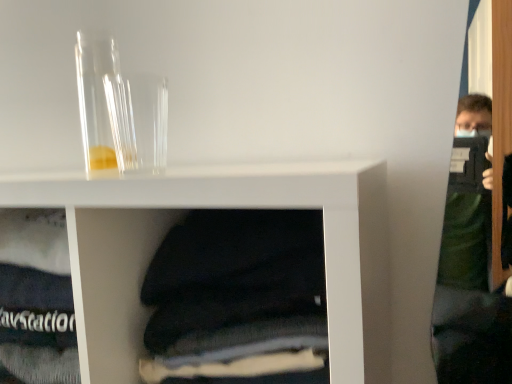
Image resolution: width=512 pixels, height=384 pixels. What are the coordinates of `transparent glass tube at upper left, positioned as the 2th glass vase in right-to-left order` in the screenshot? It's located at (102, 104).

This screenshot has width=512, height=384. Describe the element at coordinates (102, 104) in the screenshot. I see `transparent glass tube at upper left, which is counted as the first glass vase, starting from the left` at that location.

I want to click on transparent glass vase at upper left, positioned as the second glass vase in left-to-right order, so click(x=138, y=121).

What do you see at coordinates (138, 121) in the screenshot? This screenshot has height=384, width=512. I see `transparent glass vase at upper left, which is the 1th glass vase from right to left` at bounding box center [138, 121].

Find the location of `transparent glass tube at upper left, positioned as the 2th glass vase in right-to-left order`. transparent glass tube at upper left, positioned as the 2th glass vase in right-to-left order is located at coordinates (102, 104).

Which object is positioned more to the left, transparent glass vase at upper left, which is the 1th glass vase from right to left, or transparent glass tube at upper left, which is counted as the first glass vase, starting from the left?

transparent glass tube at upper left, which is counted as the first glass vase, starting from the left, is more to the left.

In the image, is transparent glass vase at upper left, positioned as the second glass vase in left-to-right order, positioned in front of or behind transparent glass tube at upper left, which is counted as the first glass vase, starting from the left?

Clearly, transparent glass vase at upper left, positioned as the second glass vase in left-to-right order, is in front of transparent glass tube at upper left, which is counted as the first glass vase, starting from the left.

Is point (110, 94) more distant than point (108, 44)?

No, it is in front of (108, 44).

From the image's perspective, is transparent glass vase at upper left, which is the 1th glass vase from right to left, positioned above or below transparent glass tube at upper left, which is counted as the first glass vase, starting from the left?

Based on their image positions, transparent glass vase at upper left, which is the 1th glass vase from right to left, is located beneath transparent glass tube at upper left, which is counted as the first glass vase, starting from the left.

From a real-world perspective, is transparent glass vase at upper left, positioned as the second glass vase in left-to-right order, positioned under transparent glass tube at upper left, which is counted as the first glass vase, starting from the left, based on gravity?

Indeed, from a real-world perspective, transparent glass vase at upper left, positioned as the second glass vase in left-to-right order, is positioned beneath transparent glass tube at upper left, which is counted as the first glass vase, starting from the left.

Does transparent glass vase at upper left, which is the 1th glass vase from right to left, have a greater width compared to transparent glass tube at upper left, which is counted as the first glass vase, starting from the left?

Yes.

Considering the relative sizes of transparent glass vase at upper left, which is the 1th glass vase from right to left, and transparent glass tube at upper left, which is counted as the first glass vase, starting from the left, in the image provided, is transparent glass vase at upper left, which is the 1th glass vase from right to left, taller than transparent glass tube at upper left, which is counted as the first glass vase, starting from the left,?

Incorrect, the height of transparent glass vase at upper left, which is the 1th glass vase from right to left, is not larger of that of transparent glass tube at upper left, which is counted as the first glass vase, starting from the left.

Considering the sizes of objects transparent glass vase at upper left, positioned as the second glass vase in left-to-right order, and transparent glass tube at upper left, positioned as the 2th glass vase in right-to-left order, in the image provided, who is bigger, transparent glass vase at upper left, positioned as the second glass vase in left-to-right order, or transparent glass tube at upper left, positioned as the 2th glass vase in right-to-left order,?

transparent glass tube at upper left, positioned as the 2th glass vase in right-to-left order, is bigger.

Is transparent glass vase at upper left, positioned as the second glass vase in left-to-right order, located outside transparent glass tube at upper left, positioned as the 2th glass vase in right-to-left order?

transparent glass vase at upper left, positioned as the second glass vase in left-to-right order, is positioned outside transparent glass tube at upper left, positioned as the 2th glass vase in right-to-left order.

Is transparent glass vase at upper left, positioned as the second glass vase in left-to-right order, directly adjacent to transparent glass tube at upper left, positioned as the 2th glass vase in right-to-left order?

Yes, the surface of transparent glass vase at upper left, positioned as the second glass vase in left-to-right order, is in contact with transparent glass tube at upper left, positioned as the 2th glass vase in right-to-left order.

Is transparent glass vase at upper left, positioned as the second glass vase in left-to-right order, turned away from transparent glass tube at upper left, which is counted as the first glass vase, starting from the left?

transparent glass vase at upper left, positioned as the second glass vase in left-to-right order, does not have its back to transparent glass tube at upper left, which is counted as the first glass vase, starting from the left.

Image resolution: width=512 pixels, height=384 pixels. Find the location of `glass vase located above the transparent glass vase at upper left, which is the 1th glass vase from right to left (from a real-world perspective)`. glass vase located above the transparent glass vase at upper left, which is the 1th glass vase from right to left (from a real-world perspective) is located at coordinates (102, 104).

In the image, is transparent glass tube at upper left, positioned as the 2th glass vase in right-to-left order, on the left side or the right side of transparent glass vase at upper left, which is the 1th glass vase from right to left?

From the image, it's evident that transparent glass tube at upper left, positioned as the 2th glass vase in right-to-left order, is to the left of transparent glass vase at upper left, which is the 1th glass vase from right to left.

Consider the image. Considering the relative positions of transparent glass tube at upper left, positioned as the 2th glass vase in right-to-left order, and transparent glass vase at upper left, positioned as the second glass vase in left-to-right order, in the image provided, is transparent glass tube at upper left, positioned as the 2th glass vase in right-to-left order, behind transparent glass vase at upper left, positioned as the second glass vase in left-to-right order,?

Yes, transparent glass tube at upper left, positioned as the 2th glass vase in right-to-left order, is further from the camera.

Which is less distant, (83, 71) or (146, 92)?

The point (146, 92) is closer.

From the image's perspective, between transparent glass tube at upper left, which is counted as the first glass vase, starting from the left, and transparent glass vase at upper left, which is the 1th glass vase from right to left, who is located below?

transparent glass vase at upper left, which is the 1th glass vase from right to left, is shown below in the image.

From a real-world perspective, who is located higher, transparent glass tube at upper left, which is counted as the first glass vase, starting from the left, or transparent glass vase at upper left, which is the 1th glass vase from right to left?

transparent glass tube at upper left, which is counted as the first glass vase, starting from the left, is physically above.

From the picture: Looking at their sizes, would you say transparent glass tube at upper left, positioned as the 2th glass vase in right-to-left order, is wider or thinner than transparent glass vase at upper left, positioned as the second glass vase in left-to-right order?

transparent glass tube at upper left, positioned as the 2th glass vase in right-to-left order, is thinner than transparent glass vase at upper left, positioned as the second glass vase in left-to-right order.

Between transparent glass tube at upper left, positioned as the 2th glass vase in right-to-left order, and transparent glass vase at upper left, positioned as the second glass vase in left-to-right order, which one has less height?

With less height is transparent glass vase at upper left, positioned as the second glass vase in left-to-right order.

Is transparent glass tube at upper left, positioned as the 2th glass vase in right-to-left order, smaller than transparent glass vase at upper left, which is the 1th glass vase from right to left?

No.

Is transparent glass tube at upper left, which is counted as the first glass vase, starting from the left, inside or outside of transparent glass vase at upper left, positioned as the second glass vase in left-to-right order?

transparent glass tube at upper left, which is counted as the first glass vase, starting from the left, exists outside the volume of transparent glass vase at upper left, positioned as the second glass vase in left-to-right order.

Is transparent glass tube at upper left, which is counted as the first glass vase, starting from the left, next to transparent glass vase at upper left, positioned as the second glass vase in left-to-right order?

Indeed, transparent glass tube at upper left, which is counted as the first glass vase, starting from the left, and transparent glass vase at upper left, positioned as the second glass vase in left-to-right order, are beside each other and touching.

Is transparent glass tube at upper left, which is counted as the first glass vase, starting from the left, looking in the opposite direction of transparent glass vase at upper left, positioned as the second glass vase in left-to-right order?

No, transparent glass tube at upper left, which is counted as the first glass vase, starting from the left,'s orientation is not away from transparent glass vase at upper left, positioned as the second glass vase in left-to-right order.

How different are the orientations of transparent glass tube at upper left, which is counted as the first glass vase, starting from the left, and transparent glass vase at upper left, positioned as the second glass vase in left-to-right order, in degrees?

The angle between the facing direction of transparent glass tube at upper left, which is counted as the first glass vase, starting from the left, and the facing direction of transparent glass vase at upper left, positioned as the second glass vase in left-to-right order, is 0.00056 degrees.

This screenshot has width=512, height=384. I want to click on glass vase behind the transparent glass vase at upper left, positioned as the second glass vase in left-to-right order, so click(x=102, y=104).

Locate an element on the screen. The height and width of the screenshot is (384, 512). glass vase on the left of transparent glass vase at upper left, which is the 1th glass vase from right to left is located at coordinates (102, 104).

Identify the location of glass vase above the transparent glass vase at upper left, which is the 1th glass vase from right to left (from the image's perspective). The image size is (512, 384). (102, 104).